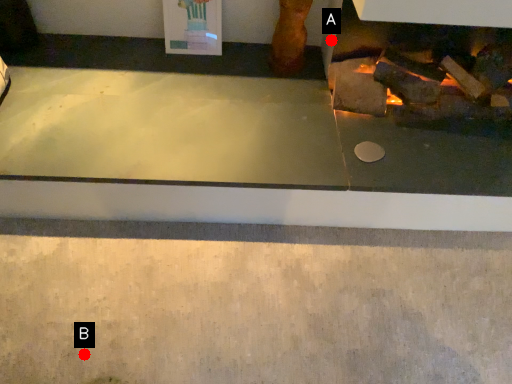
Question: Two points are circled on the image, labeled by A and B beside each circle. Among these points, which one is farthest from the camera?

Choices:
 (A) A is further
 (B) B is further

Answer: (A)